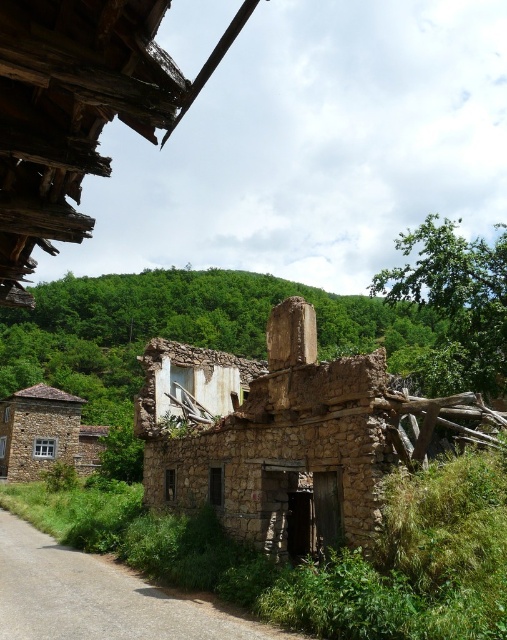
You are standing in front of the old stone building and notice a point marked at coordinates (77, 109). What does this point indicate?

The point at coordinates 0.152 indicates the location of the rusty metal roof at upper left.